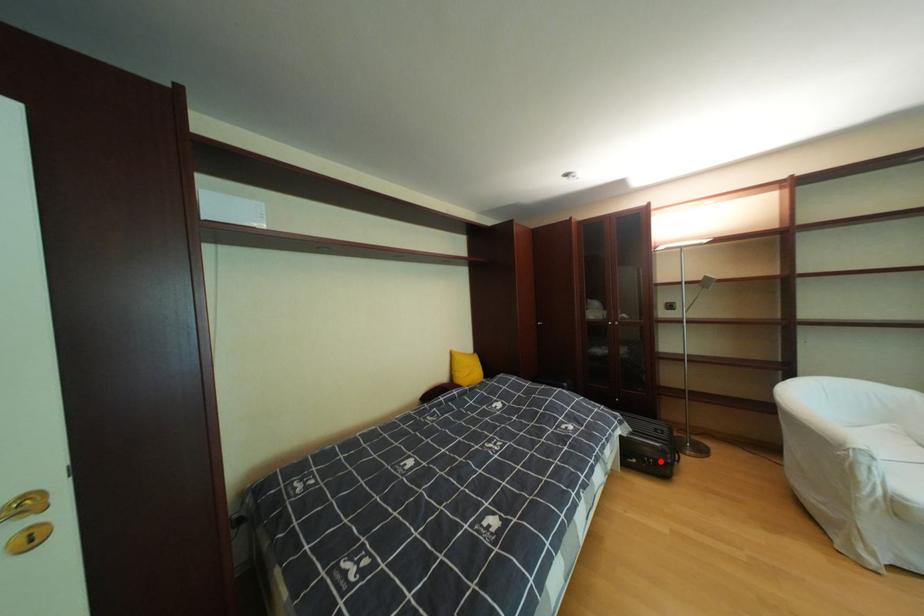
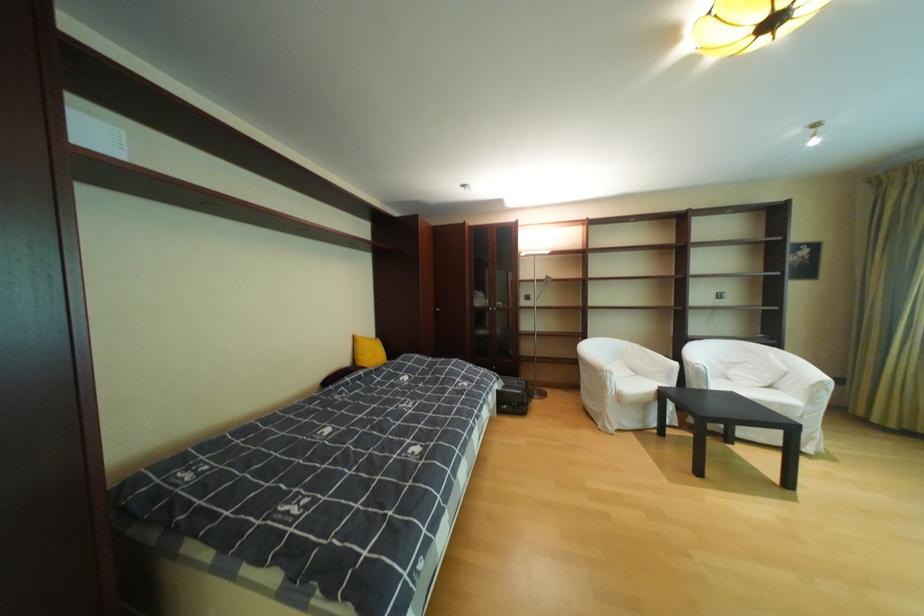
Question: I am providing you with two images of the same scene from different viewpoints. In image1, a red point is highlighted. Considering the same 3D point in image2, which of the following is correct?

Choices:
 (A) It is closer
 (B) It is farther

Answer: (B)